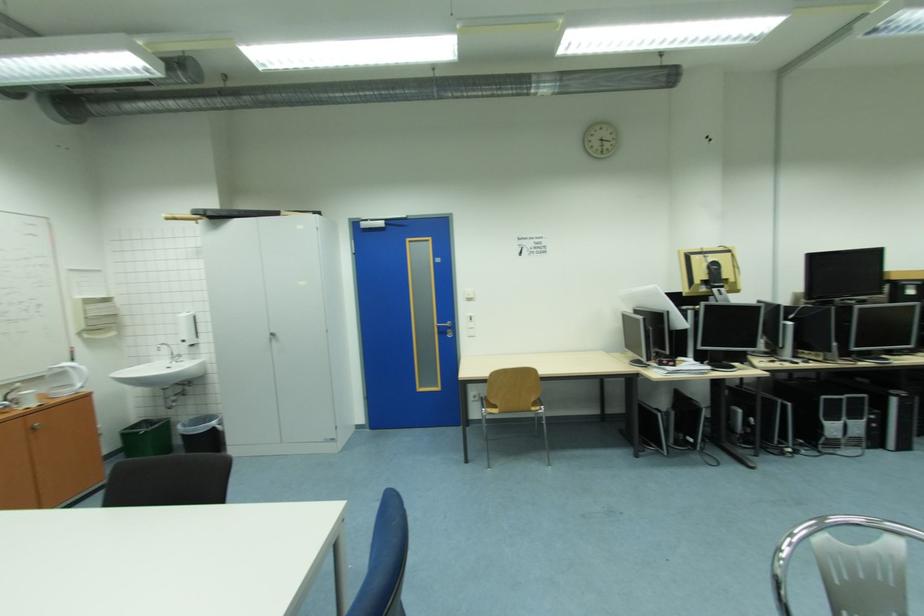
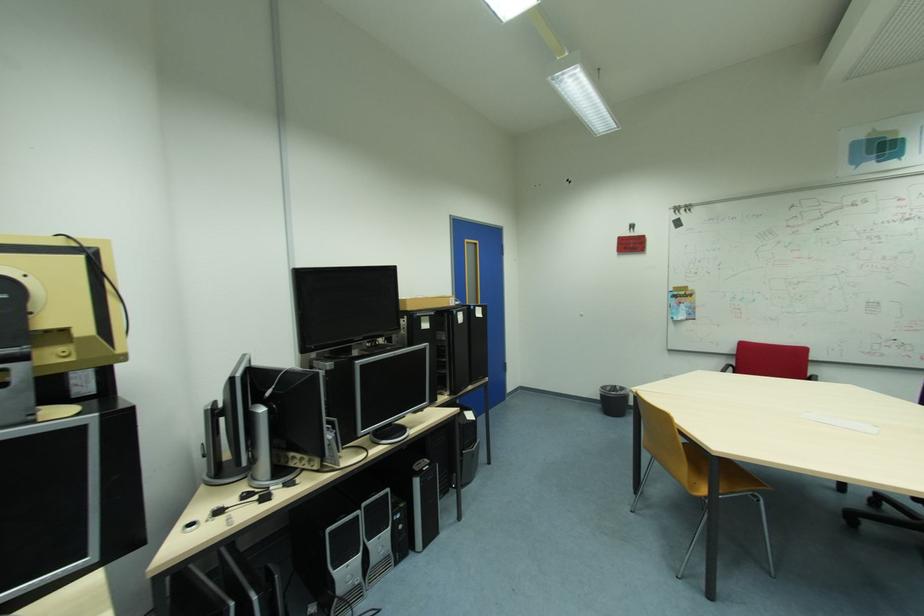
In the second image, find the point that corresponds to the point at 830,398 in the first image.

(335, 530)